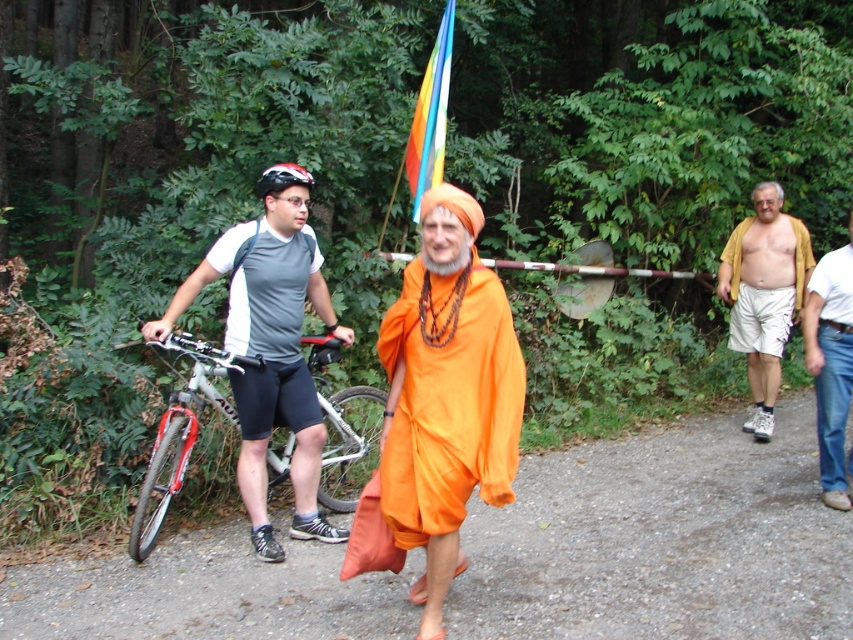
Question: Which object is closer to the camera taking this photo?

Choices:
 (A) orange fabric bag at center
 (B) silver metallic bicycle at left
 (C) white cotton shirt at right
 (D) tan fabric shirt at right

Answer: (B)

Question: Does orange fabric bag at center appear over silver metallic bicycle at left?

Choices:
 (A) yes
 (B) no

Answer: (B)

Question: Which object is the closest to the tan fabric shirt at right?

Choices:
 (A) white cotton shirt at right
 (B) silver metallic bicycle at left
 (C) orange fabric dhoti at center
 (D) orange fabric bag at center

Answer: (A)

Question: Does tan fabric shirt at right come in front of white cotton shirt at right?

Choices:
 (A) yes
 (B) no

Answer: (B)

Question: Is orange fabric dhoti at center closer to camera compared to white cotton shirt at right?

Choices:
 (A) no
 (B) yes

Answer: (B)

Question: Based on their relative distances, which object is farther from the tan fabric shirt at right?

Choices:
 (A) white cotton shirt at right
 (B) silver metallic bicycle at left

Answer: (B)